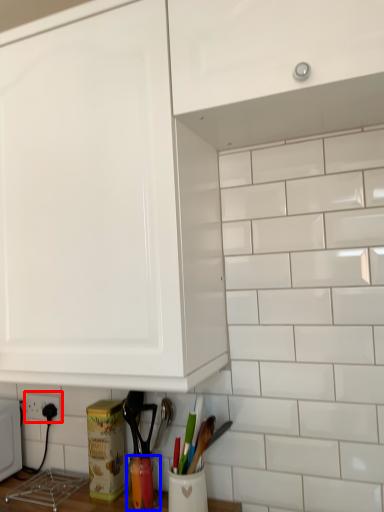
Question: Which object is further to the camera taking this photo, electric outlet (highlighted by a red box) or appliance (highlighted by a blue box)?

Choices:
 (A) electric outlet
 (B) appliance

Answer: (A)